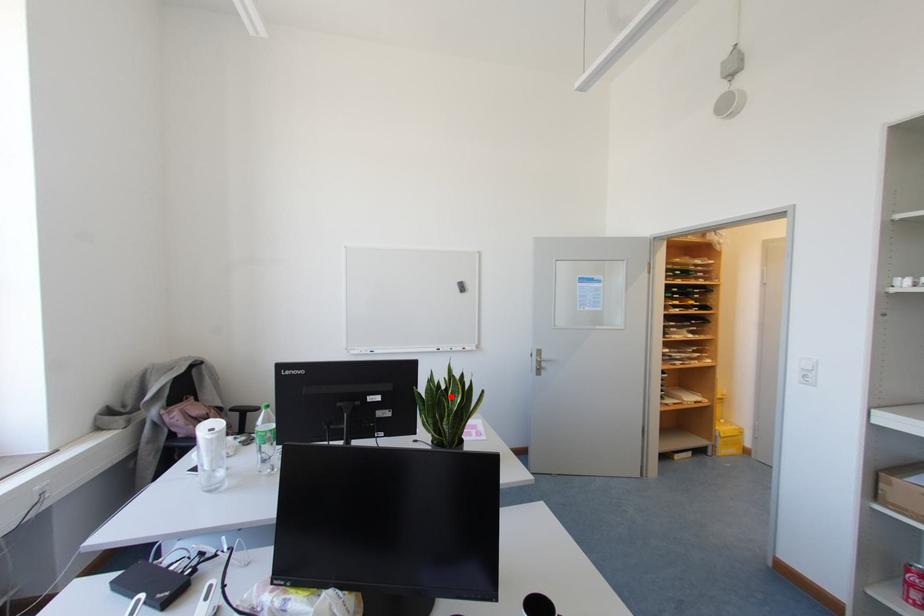
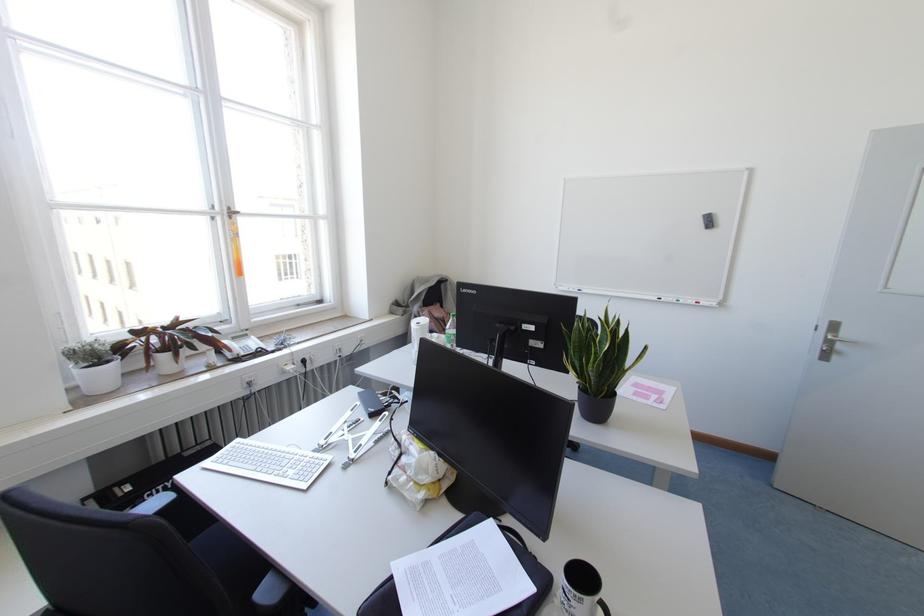
Locate, in the second image, the point that corresponds to the highlighted location in the first image.

(599, 342)